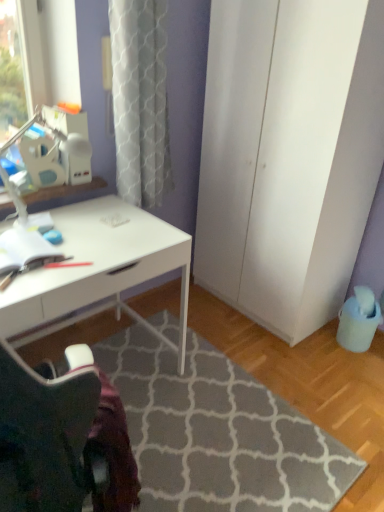
Question: Is the depth of white glossy desk at center greater than that of gray textured rug at lower center?

Choices:
 (A) yes
 (B) no

Answer: (A)

Question: From a real-world perspective, is white glossy desk at center over gray textured rug at lower center?

Choices:
 (A) no
 (B) yes

Answer: (B)

Question: Considering the relative sizes of white glossy desk at center and gray textured rug at lower center in the image provided, is white glossy desk at center wider than gray textured rug at lower center?

Choices:
 (A) yes
 (B) no

Answer: (B)

Question: Is white glossy desk at center smaller than gray textured rug at lower center?

Choices:
 (A) no
 (B) yes

Answer: (A)

Question: From the image's perspective, is white glossy desk at center under gray textured rug at lower center?

Choices:
 (A) yes
 (B) no

Answer: (B)

Question: Is white matte cabinet at right wider or thinner than white glossy desk at center?

Choices:
 (A) wide
 (B) thin

Answer: (B)

Question: From the image's perspective, is white matte cabinet at right positioned above or below white glossy desk at center?

Choices:
 (A) below
 (B) above

Answer: (B)

Question: Is white matte cabinet at right in front of or behind white glossy desk at center in the image?

Choices:
 (A) front
 (B) behind

Answer: (B)

Question: Considering the positions of point (301, 58) and point (76, 261), is point (301, 58) closer or farther from the camera than point (76, 261)?

Choices:
 (A) farther
 (B) closer

Answer: (A)

Question: In terms of size, does white glossy desk at center appear bigger or smaller than gray textured rug at lower center?

Choices:
 (A) small
 (B) big

Answer: (B)

Question: Is point (59, 216) positioned closer to the camera than point (213, 437)?

Choices:
 (A) closer
 (B) farther

Answer: (B)

Question: Visually, is white glossy desk at center positioned to the left or to the right of gray textured rug at lower center?

Choices:
 (A) right
 (B) left

Answer: (B)

Question: From a real-world perspective, relative to gray textured rug at lower center, is white glossy desk at center vertically above or below?

Choices:
 (A) below
 (B) above

Answer: (B)

Question: Considering the positions of gray textured rug at lower center and white matte cabinet at right in the image, is gray textured rug at lower center bigger or smaller than white matte cabinet at right?

Choices:
 (A) small
 (B) big

Answer: (A)

Question: Considering the positions of gray textured rug at lower center and white matte cabinet at right in the image, is gray textured rug at lower center taller or shorter than white matte cabinet at right?

Choices:
 (A) short
 (B) tall

Answer: (A)